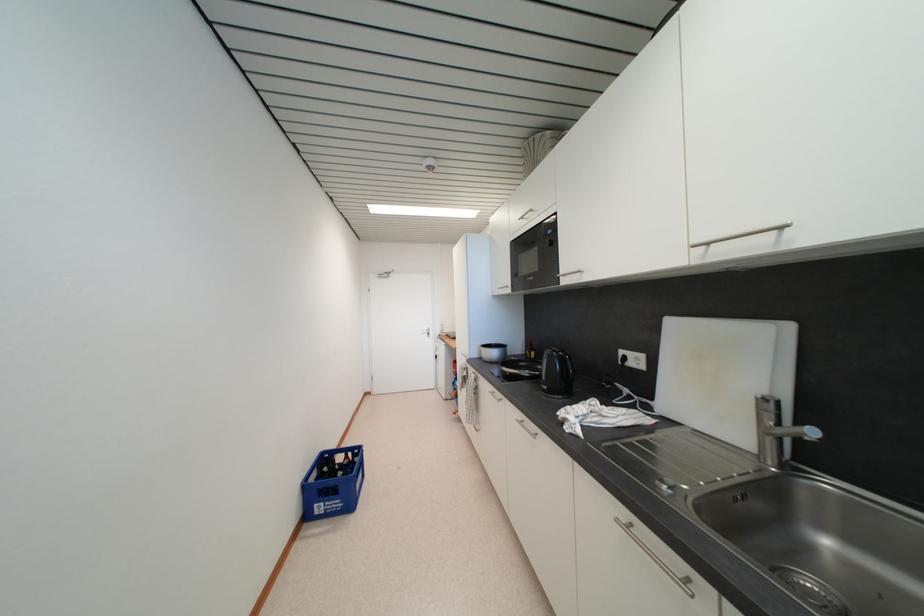
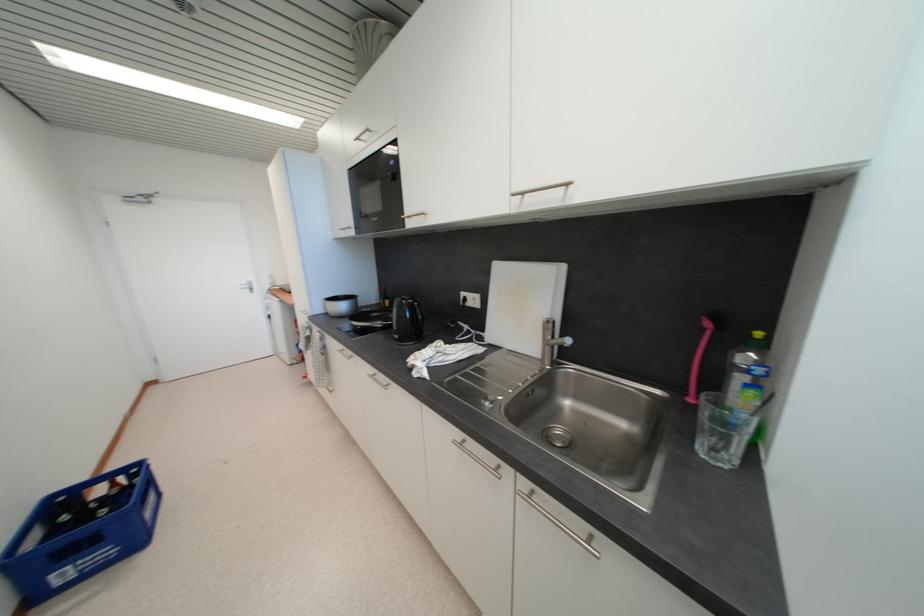
Where in the second image is the point corresponding to (x=551, y=390) from the first image?

(402, 339)